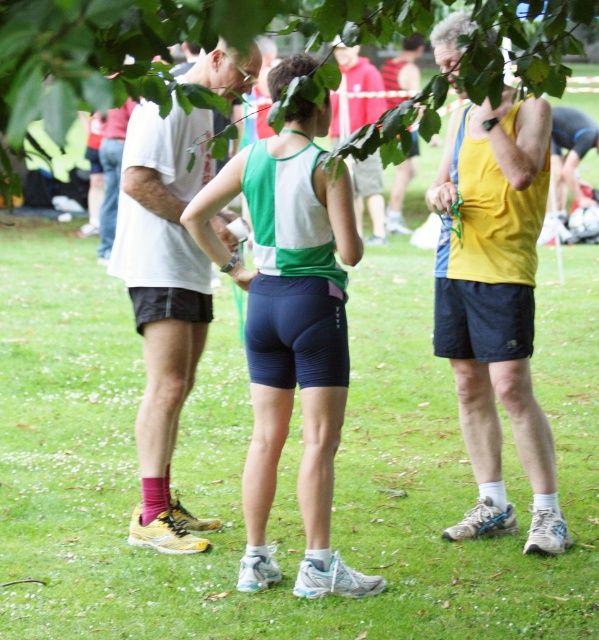
Is green grass at center closer to the viewer compared to maroon sock at left?

No, it is behind maroon sock at left.

You are a GUI agent. You are given a task and a screenshot of the screen. Output one action in this format:
    pyautogui.click(x=<x>, y=<y>)
    Task: Click on the green grass at center
    This screenshot has width=599, height=640.
    Given the screenshot: What is the action you would take?
    pyautogui.click(x=279, y=465)

Looking at this image, who is more forward, (419, 388) or (156, 336)?

Positioned in front is point (156, 336).

I want to click on green grass at center, so click(x=279, y=465).

Is green grass at center positioned at the back of yellow tank top at center?

No, green grass at center is closer to the viewer.

Which is in front, point (361, 301) or point (385, 68)?

Point (361, 301)

The height and width of the screenshot is (640, 599). In order to click on green grass at center in this screenshot , I will do `click(279, 465)`.

Does maroon sock at left have a lesser width compared to yellow tank top at center?

In fact, maroon sock at left might be wider than yellow tank top at center.

Which is in front, point (161, 534) or point (422, 49)?

Point (161, 534)

Where is `maroon sock at left`? This screenshot has height=640, width=599. maroon sock at left is located at coordinates (164, 301).